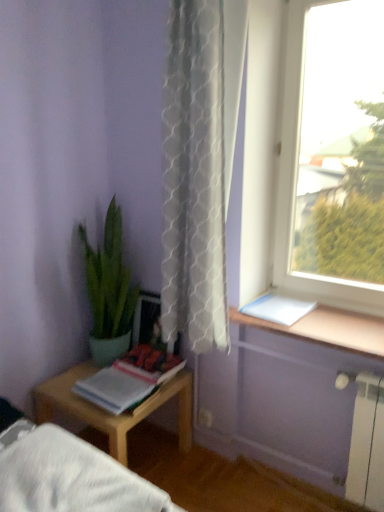
Question: Does matte paper book at lower left, which ranks as the 1th book in bottom-to-top order, come in front of white textured curtain at center?

Choices:
 (A) yes
 (B) no

Answer: (B)

Question: Is white textured curtain at center inside matte paper book at lower left, the 2th book viewed from the right?

Choices:
 (A) yes
 (B) no

Answer: (B)

Question: Considering the relative positions of matte paper book at lower left, the 2th book viewed from the right, and white textured curtain at center in the image provided, is matte paper book at lower left, the 2th book viewed from the right, behind white textured curtain at center?

Choices:
 (A) yes
 (B) no

Answer: (A)

Question: Is matte paper book at lower left, the 2th book viewed from the right, taller than white textured curtain at center?

Choices:
 (A) yes
 (B) no

Answer: (B)

Question: Does matte paper book at lower left, the 1th book from the left, turn towards white textured curtain at center?

Choices:
 (A) yes
 (B) no

Answer: (B)

Question: Considering the relative positions of matte paper book at lower left, the 1th book from the left, and white textured curtain at center in the image provided, is matte paper book at lower left, the 1th book from the left, to the left of white textured curtain at center from the viewer's perspective?

Choices:
 (A) no
 (B) yes

Answer: (B)

Question: Is matte paper book at lower left, which ranks as the 1th book in bottom-to-top order, bigger than transparent glass window at upper right?

Choices:
 (A) no
 (B) yes

Answer: (A)

Question: Is matte paper book at lower left, which ranks as the 1th book in bottom-to-top order, not near transparent glass window at upper right?

Choices:
 (A) no
 (B) yes

Answer: (A)

Question: From a real-world perspective, is matte paper book at lower left, the 2th book viewed from the right, physically above transparent glass window at upper right?

Choices:
 (A) yes
 (B) no

Answer: (B)

Question: From the image's perspective, is matte paper book at lower left, placed as the second book when sorted from top to bottom, under transparent glass window at upper right?

Choices:
 (A) no
 (B) yes

Answer: (B)

Question: Considering the relative sizes of matte paper book at lower left, the 1th book from the left, and transparent glass window at upper right in the image provided, is matte paper book at lower left, the 1th book from the left, taller than transparent glass window at upper right?

Choices:
 (A) no
 (B) yes

Answer: (A)

Question: Is transparent glass window at upper right at the back of matte paper book at lower left, the 2th book viewed from the right?

Choices:
 (A) no
 (B) yes

Answer: (A)

Question: Can you confirm if transparent glass window at upper right is positioned to the right of wooden table at left?

Choices:
 (A) yes
 (B) no

Answer: (A)